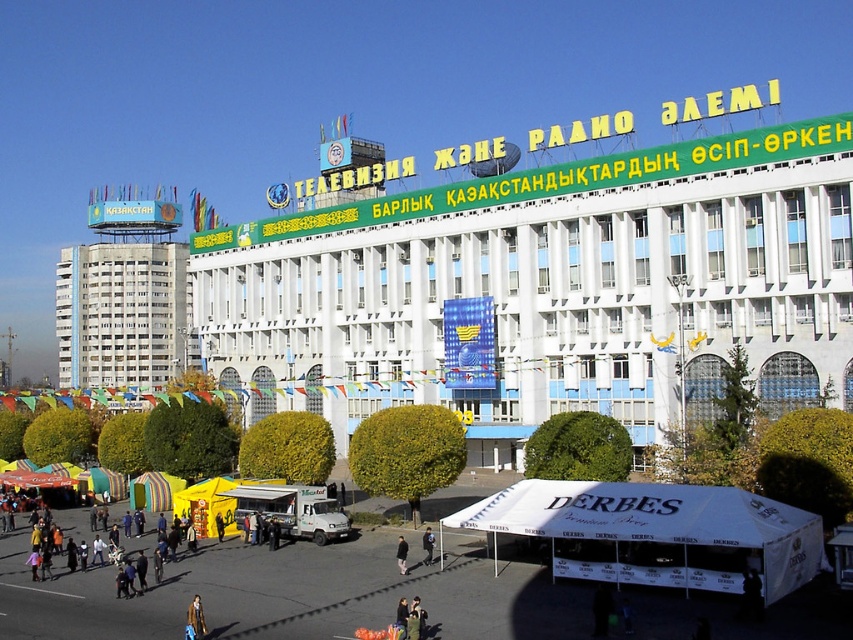
Question: Which of the following is the farthest from the observer?

Choices:
 (A) yellow fabric canopy at lower left
 (B) striped fabric canopy at center
 (C) blue denim jacket at lower center

Answer: (B)

Question: Which of these objects is positioned farthest from the white concrete building at left?

Choices:
 (A) white fabric canopy at lower center
 (B) black fabric person at center
 (C) black fabric umbrella at center
 (D) green fabric jacket at center

Answer: (D)

Question: Which of the following is the closest to the observer?

Choices:
 (A) (131, 490)
 (B) (192, 497)

Answer: (B)

Question: Observing the image, what is the correct spatial positioning of blue denim jacket at lower center in reference to black fabric umbrella at center?

Choices:
 (A) right
 (B) left

Answer: (B)

Question: Is green fabric jacket at center smaller than dark brown leather jacket at lower center?

Choices:
 (A) yes
 (B) no

Answer: (B)

Question: Is blue denim jacket at lower center wider than black fabric person at center?

Choices:
 (A) yes
 (B) no

Answer: (B)